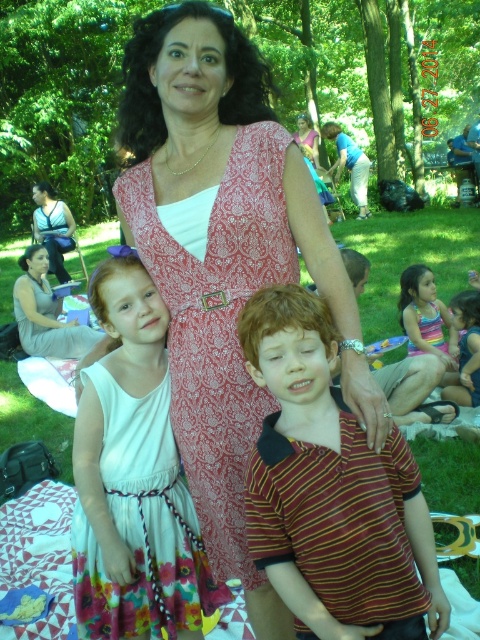
Who is more distant from viewer, (340, 464) or (477, 385)?

Point (477, 385)

Can you confirm if striped cotton shirt at center is positioned to the left of white cotton dress at lower right?

Yes, striped cotton shirt at center is to the left of white cotton dress at lower right.

Identify the location of striped cotton shirt at center. (331, 486).

Which of these two, white floral dress at center or matte black tank top at upper left, stands shorter?

Standing shorter between the two is matte black tank top at upper left.

Describe the element at coordinates (141, 524) in the screenshot. I see `white floral dress at center` at that location.

Does point (132, 513) lie in front of point (72, 216)?

Yes, it is in front of point (72, 216).

What are the coordinates of `white floral dress at center` in the screenshot? It's located at (141, 524).

Between patterned fabric dress at center and matte gray dress at center, which one has less height?

matte gray dress at center

Is patterned fabric dress at center wider than matte gray dress at center?

No, patterned fabric dress at center is not wider than matte gray dress at center.

Who is more forward, (x=237, y=387) or (x=49, y=353)?

Point (x=237, y=387) is in front.

This screenshot has height=640, width=480. What are the coordinates of `patterned fabric dress at center` in the screenshot? It's located at point(224,257).